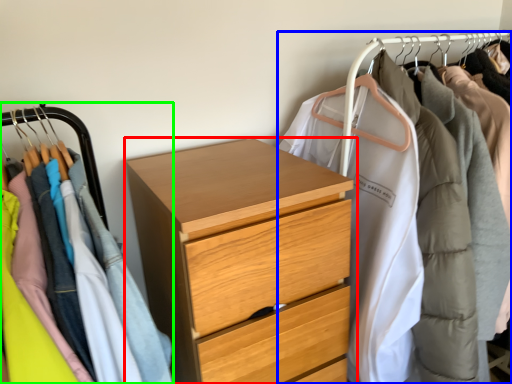
Question: Based on their relative distances, which object is farther from chest of drawers (highlighted by a red box)? Choose from closet (highlighted by a blue box) and closet (highlighted by a green box).

Choices:
 (A) closet
 (B) closet

Answer: (A)